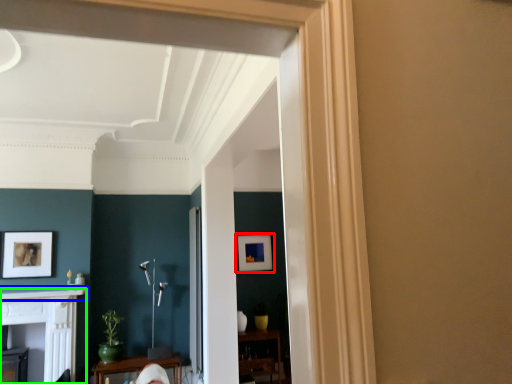
Question: Which object is the closest to the picture frame (highlighted by a red box)? Choose among these: mantle (highlighted by a blue box) or fireplace (highlighted by a green box).

Choices:
 (A) mantle
 (B) fireplace

Answer: (A)